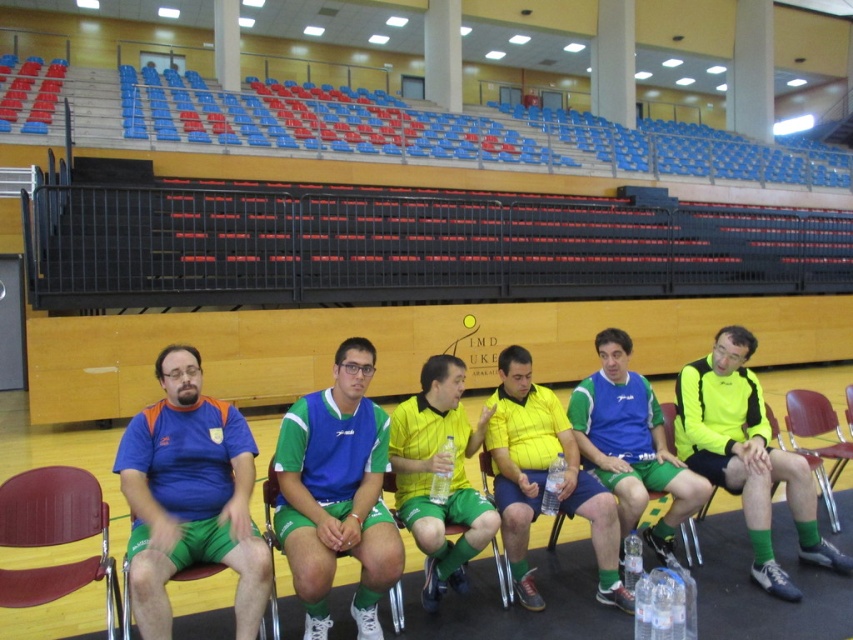
Question: Does matte blue jersey at center have a lesser width compared to wooden chair at center?

Choices:
 (A) yes
 (B) no

Answer: (A)

Question: Is matte blue jersey at center thinner than matte green shorts at center?

Choices:
 (A) yes
 (B) no

Answer: (A)

Question: Which point appears closest to the camera in this image?

Choices:
 (A) (223, 538)
 (B) (825, 490)
 (C) (517, 368)

Answer: (A)

Question: Where is yellow jersey at center located in relation to wooden chair at center in the image?

Choices:
 (A) left
 (B) right

Answer: (A)

Question: Which object appears farthest from the camera in this image?

Choices:
 (A) yellow matte shirt at center
 (B) yellow-green jersey at center

Answer: (B)

Question: Which of the following is the farthest from the observer?

Choices:
 (A) (498, 444)
 (B) (618, 404)
 (C) (189, 403)
 (D) (408, 408)

Answer: (B)